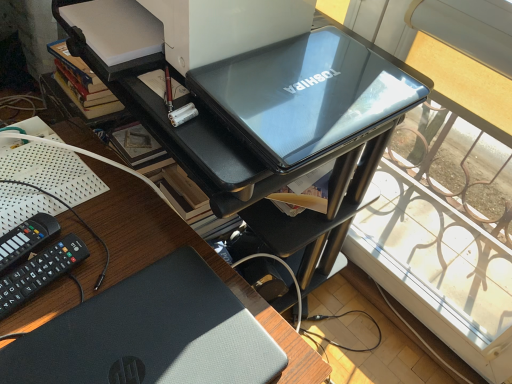
Where is `empty space that is ontop of slate gray matte laptop at lower left (from a real-world perspective)`? empty space that is ontop of slate gray matte laptop at lower left (from a real-world perspective) is located at coordinates (147, 340).